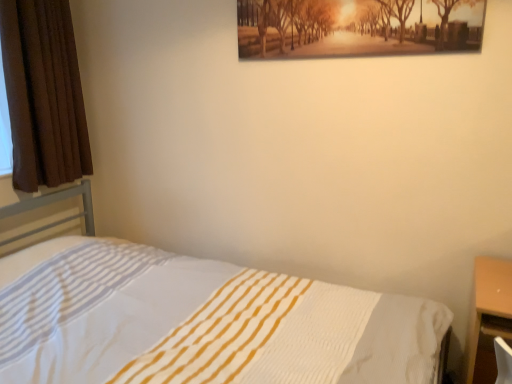
Question: In the image, is matte wooden picture frame at upper center on the left side or the right side of brown velvet curtain at left?

Choices:
 (A) left
 (B) right

Answer: (B)

Question: From the image's perspective, is matte wooden picture frame at upper center above or below brown velvet curtain at left?

Choices:
 (A) below
 (B) above

Answer: (B)

Question: Which is farther from the brown velvet curtain at left?

Choices:
 (A) white textured bed at center
 (B) matte wooden picture frame at upper center

Answer: (B)

Question: Based on their relative distances, which object is nearer to the matte wooden picture frame at upper center?

Choices:
 (A) white textured bed at center
 (B) brown velvet curtain at left

Answer: (A)